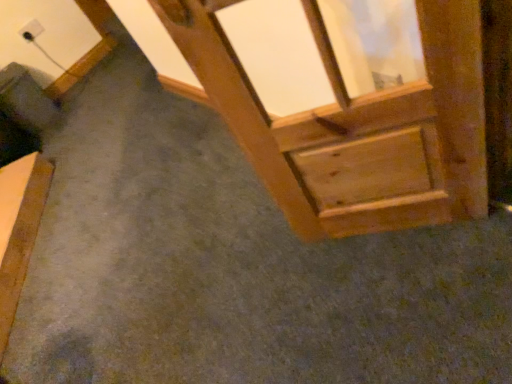
Question: Is wooden bed frame at lower left shorter than wooden frame at upper right?

Choices:
 (A) no
 (B) yes

Answer: (B)

Question: Is wooden bed frame at lower left far away from wooden frame at upper right?

Choices:
 (A) no
 (B) yes

Answer: (B)

Question: Is wooden bed frame at lower left further to the viewer compared to wooden frame at upper right?

Choices:
 (A) yes
 (B) no

Answer: (A)

Question: Is wooden bed frame at lower left to the left of wooden frame at upper right from the viewer's perspective?

Choices:
 (A) yes
 (B) no

Answer: (A)

Question: Can you confirm if wooden bed frame at lower left is smaller than wooden frame at upper right?

Choices:
 (A) yes
 (B) no

Answer: (A)

Question: Is wooden bed frame at lower left facing towards wooden frame at upper right?

Choices:
 (A) no
 (B) yes

Answer: (A)

Question: Is white plastic outlet at upper left aimed at wooden frame at upper right?

Choices:
 (A) yes
 (B) no

Answer: (A)

Question: Can you see white plastic outlet at upper left touching wooden frame at upper right?

Choices:
 (A) yes
 (B) no

Answer: (B)

Question: From a real-world perspective, is white plastic outlet at upper left physically above wooden frame at upper right?

Choices:
 (A) no
 (B) yes

Answer: (A)

Question: Does white plastic outlet at upper left have a greater width compared to wooden frame at upper right?

Choices:
 (A) no
 (B) yes

Answer: (A)

Question: Does white plastic outlet at upper left appear on the left side of wooden frame at upper right?

Choices:
 (A) no
 (B) yes

Answer: (B)

Question: Is white plastic outlet at upper left positioned in front of wooden frame at upper right?

Choices:
 (A) no
 (B) yes

Answer: (A)

Question: Is white plastic outlet at upper left in front of wooden bed frame at lower left?

Choices:
 (A) no
 (B) yes

Answer: (A)